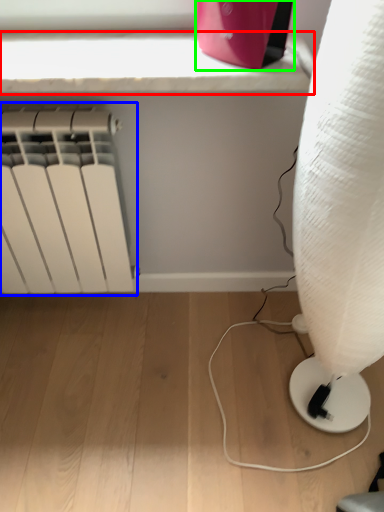
Question: Considering the real-world distances, which object is farthest from window sill (highlighted by a red box)? radiator (highlighted by a blue box) or appliance (highlighted by a green box)?

Choices:
 (A) radiator
 (B) appliance

Answer: (A)